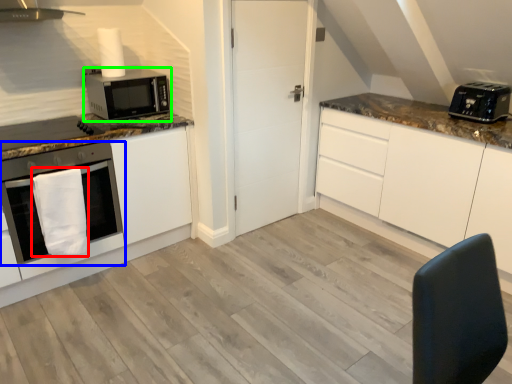
Question: Which object is positioned closest to hand towel (highlighted by a red box)? Select from oven (highlighted by a blue box) and microwave oven (highlighted by a green box).

Choices:
 (A) oven
 (B) microwave oven

Answer: (A)